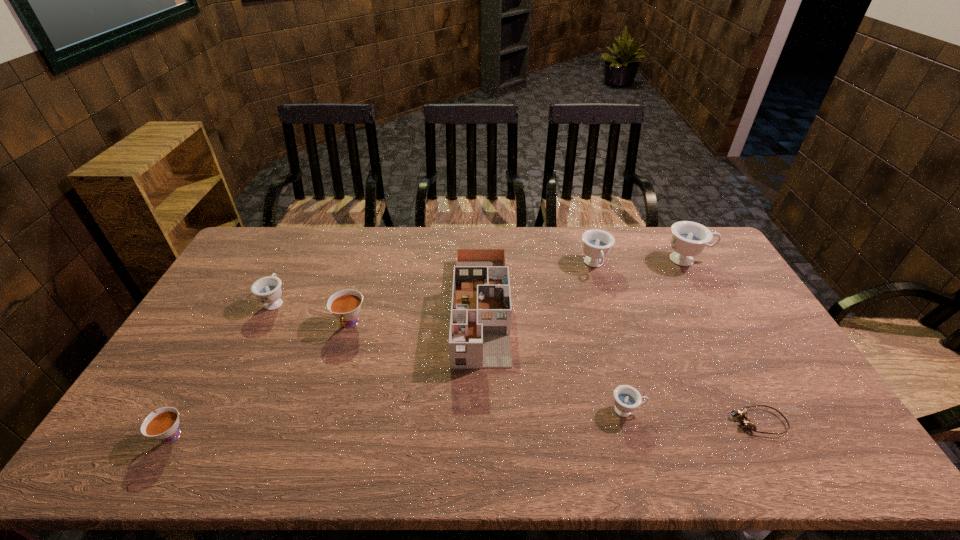
Image resolution: width=960 pixels, height=540 pixels. I want to click on the rightmost teacup, so click(689, 239).

In order to click on the rightmost blue teacup in this screenshot , I will do `click(689, 239)`.

The image size is (960, 540). I want to click on dollhouse, so click(480, 324).

In order to click on the fifth object from right to left in this screenshot , I will do `click(480, 324)`.

Identify the location of the third smallest blue teacup. (597, 243).

Locate an element on the screen. the bigger white teacup is located at coordinates (345, 305).

At what (x,y) coordinates should I click in order to perform the action: click on the third object from left to right. Please return your answer as a coordinate pair (x, y). Image resolution: width=960 pixels, height=540 pixels. Looking at the image, I should click on (345, 305).

This screenshot has width=960, height=540. Find the location of `the third farthest blue teacup`. the third farthest blue teacup is located at coordinates (268, 290).

I want to click on the second smallest blue teacup, so click(268, 290).

Where is `the smaller white teacup`? the smaller white teacup is located at coordinates 164,425.